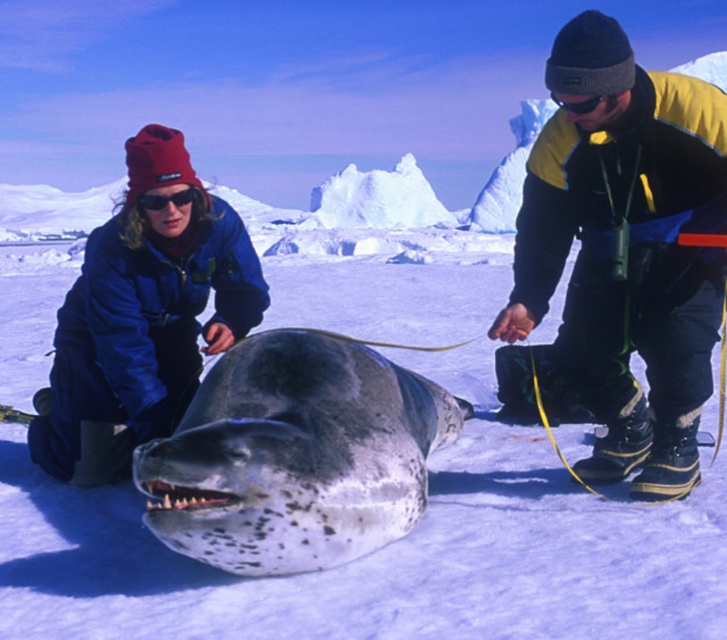
You are a wildlife photographer trying to capture a photo of the seal in the snowy landscape. You notice the black fleece jacket at center and the white ice at center. Which object is closer to the camera, based on their sizes?

The black fleece jacket at center is taller than the white ice at center, so it is closer to the camera.

You are standing at the point labeled as point (624, 250) in the image. What object is directly in front of you?

The point (624, 250) corresponds to the black fleece jacket at center, so the object directly in front of you is the black fleece jacket at center.